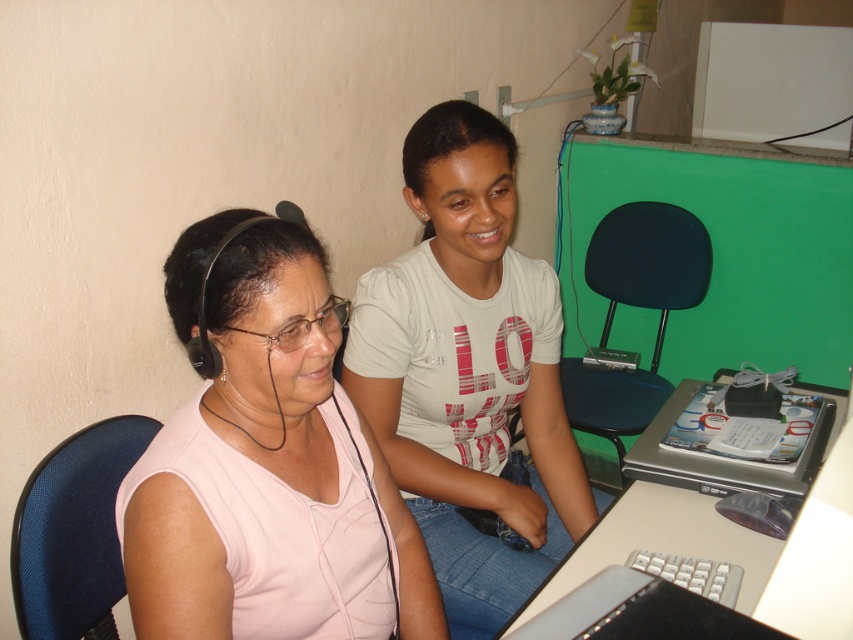
Looking at this image, you are standing in front of the desk and want to reach the point at coordinates (x=769, y=595). The desk is 28 inches wide. Can you comfortably reach that point without moving your body?

The point at coordinates (x=769, y=595) is 27.76 inches away from the viewer. Since the desk is 28 inches wide, you can comfortably reach it without moving your body as the distance is just slightly less than the desk width.

What are the coordinates of the white cotton shirt at center?

The white cotton shirt at center is located at point (468, 369).